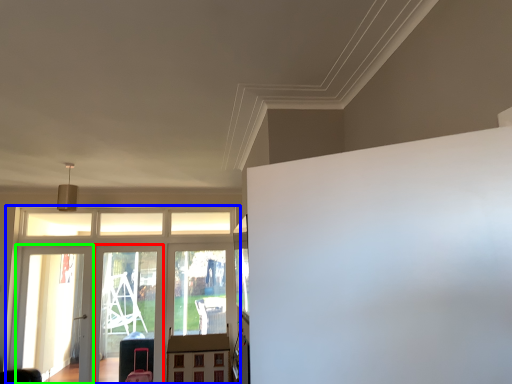
Question: Based on their relative distances, which object is nearer to screen door (highlighted by a red box)? Choose from elevator (highlighted by a blue box) and screen door (highlighted by a green box).

Choices:
 (A) elevator
 (B) screen door

Answer: (A)